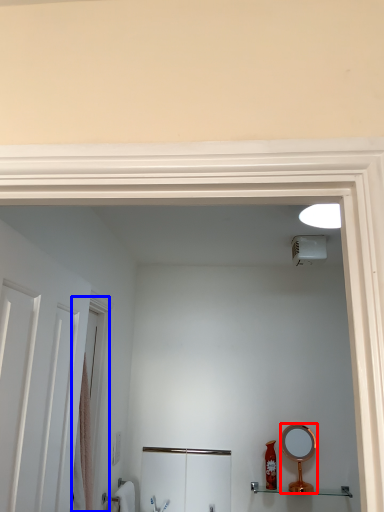
Question: Which point is further to the camera, mirror (highlighted by a red box) or screen door (highlighted by a blue box)?

Choices:
 (A) mirror
 (B) screen door

Answer: (A)